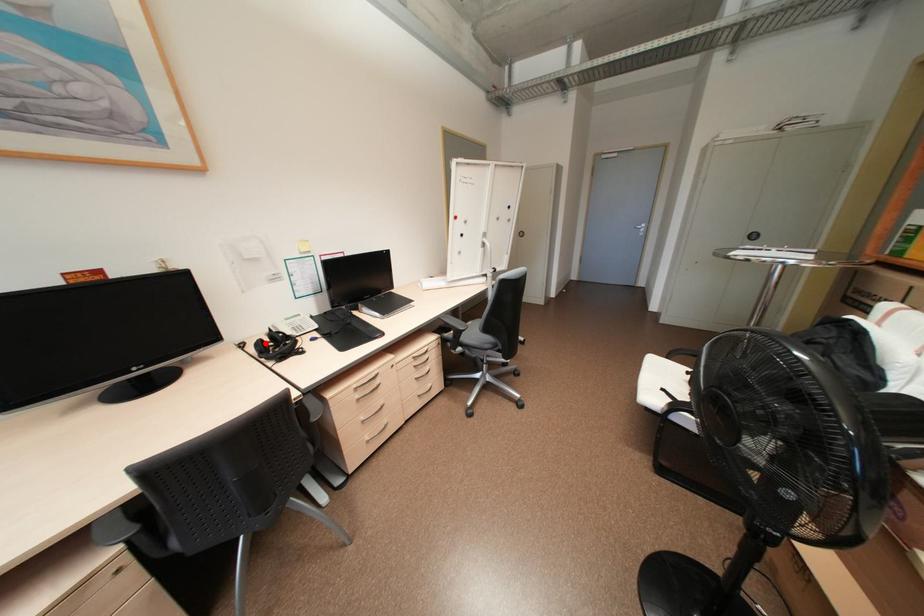
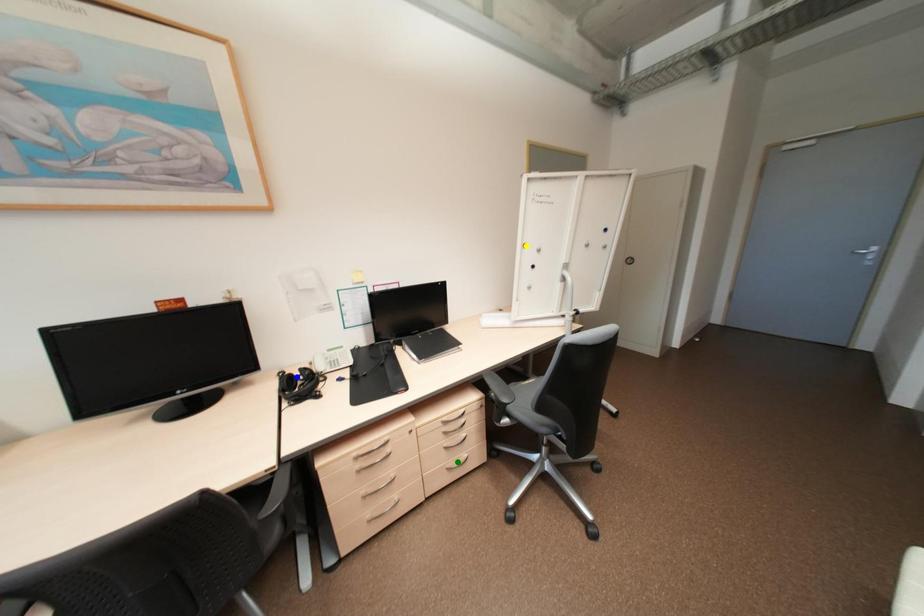
Question: I am providing you with two images of the same scene from different viewpoints. A red point is marked on the first image. You are given multiple points on the second image. Which spot in image 2 lines up with the point in image 1?

Choices:
 (A) green point
 (B) blue point
 (C) yellow point

Answer: (B)